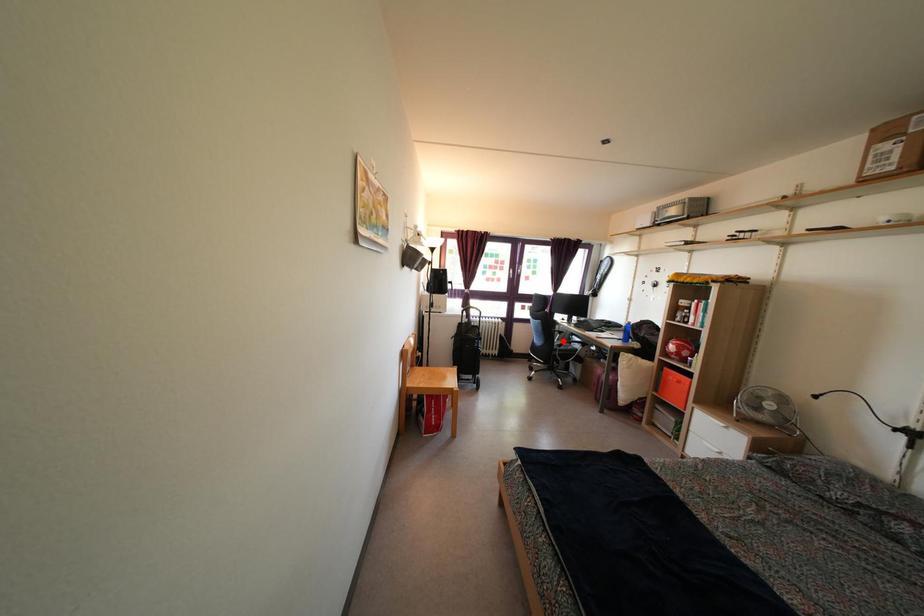
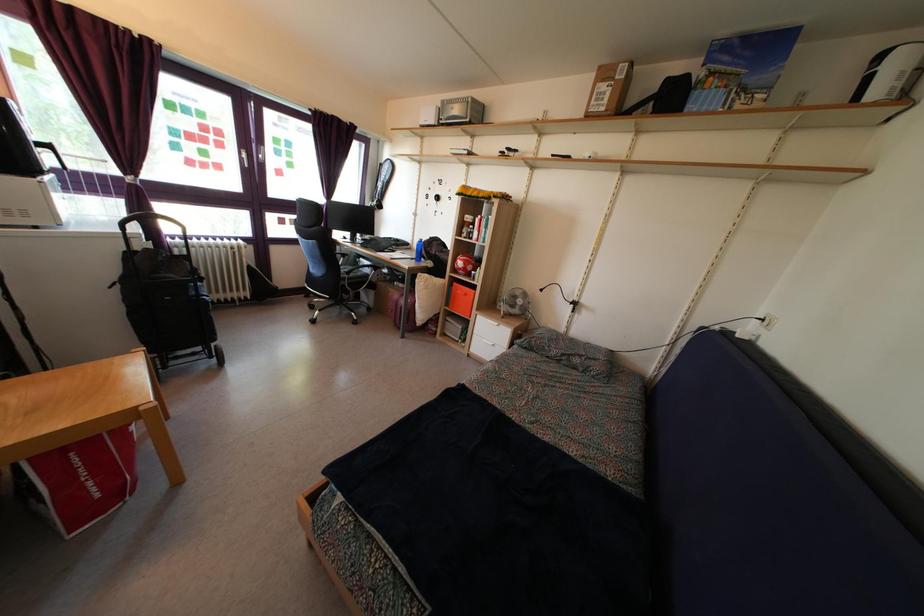
Question: I am providing you with two images of the same scene from different viewpoints. A red point is marked on the first image. Can you still see the location of the red point in image 2?

Choices:
 (A) Yes
 (B) No

Answer: (A)